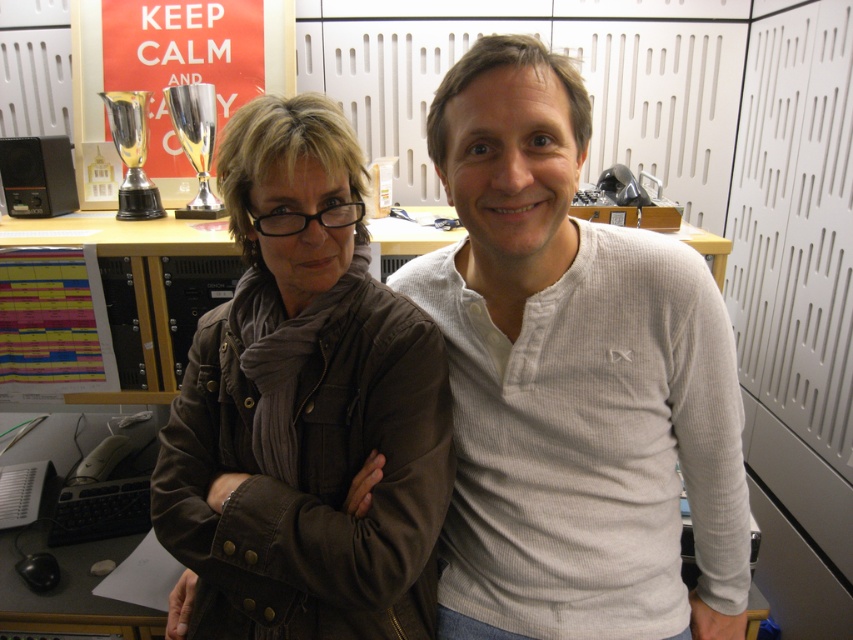
Is white ribbed sweater at center in front of brown leather jacket at center?

Yes, it is in front of brown leather jacket at center.

Which is behind, point (550, 166) or point (361, 275)?

Positioned behind is point (361, 275).

At what (x,y) coordinates should I click in order to perform the action: click on white ribbed sweater at center. Please return your answer as a coordinate pair (x, y). The height and width of the screenshot is (640, 853). Looking at the image, I should click on (572, 381).